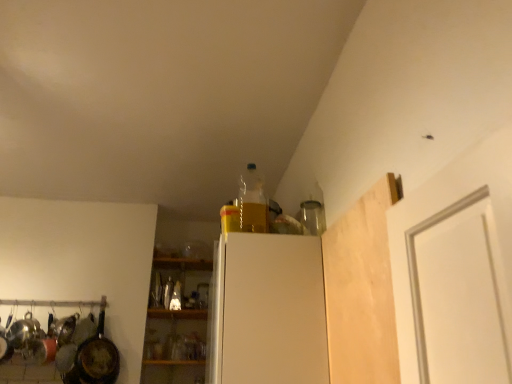
Find the location of a particular element. The image size is (512, 384). light wood/rough plank at upper right is located at coordinates (361, 290).

This screenshot has width=512, height=384. What do you see at coordinates (252, 202) in the screenshot? I see `translucent plastic bottle at upper center, acting as the 1th bottle starting from the front` at bounding box center [252, 202].

The height and width of the screenshot is (384, 512). What do you see at coordinates (97, 357) in the screenshot? I see `rusty metal frying pan at left` at bounding box center [97, 357].

The width and height of the screenshot is (512, 384). What do you see at coordinates (267, 311) in the screenshot?
I see `white matte refrigerator at center` at bounding box center [267, 311].

At what (x,y) coordinates should I click in order to perform the action: click on white matte refrigerator at center. Please return your answer as a coordinate pair (x, y). The image size is (512, 384). Looking at the image, I should click on pyautogui.click(x=267, y=311).

Locate an element on the screen. Image resolution: width=512 pixels, height=384 pixels. translucent glass bottle at center, which is counted as the 2th bottle, starting from the bottom is located at coordinates (168, 292).

Which is closer to the camera, (106, 362) or (253, 185)?

The point (253, 185) is more forward.

From the image's perspective, which one is positioned lower, rusty metal frying pan at left or translucent plastic bottle at upper center, which appears as the first bottle when viewed from the top?

rusty metal frying pan at left.

Considering the sizes of objects rusty metal frying pan at left and translucent plastic bottle at upper center, placed as the third bottle when sorted from bottom to top, in the image provided, who is taller, rusty metal frying pan at left or translucent plastic bottle at upper center, placed as the third bottle when sorted from bottom to top,?

rusty metal frying pan at left is taller.

Which of these two, rusty metal frying pan at left or translucent plastic bottle at upper center, the third bottle in the left-to-right sequence, is bigger?

rusty metal frying pan at left is bigger.

Which is more to the right, translucent plastic bottle at upper center, which appears as the first bottle when viewed from the top, or white matte refrigerator at center?

translucent plastic bottle at upper center, which appears as the first bottle when viewed from the top, is more to the right.

Does translucent plastic bottle at upper center, placed as the third bottle when sorted from bottom to top, have a larger size compared to white matte refrigerator at center?

No.

Are translucent plastic bottle at upper center, the third bottle in the left-to-right sequence, and white matte refrigerator at center located far from each other?

translucent plastic bottle at upper center, the third bottle in the left-to-right sequence, is actually quite close to white matte refrigerator at center.

Considering their positions, is translucent plastic bottle at upper center, the third bottle in the left-to-right sequence, located in front of or behind white matte refrigerator at center?

Visually, translucent plastic bottle at upper center, the third bottle in the left-to-right sequence, is located behind white matte refrigerator at center.

From the image's perspective, who appears lower, light wood/rough plank at upper right or translucent plastic bottle at upper center, placed as the third bottle when sorted from bottom to top?

light wood/rough plank at upper right, from the image's perspective.

Is light wood/rough plank at upper right thinner than translucent plastic bottle at upper center, which appears as the first bottle when viewed from the top?

Yes, light wood/rough plank at upper right is thinner than translucent plastic bottle at upper center, which appears as the first bottle when viewed from the top.

Consider the image. Are light wood/rough plank at upper right and translucent plastic bottle at upper center, marked as the 1th bottle in a right-to-left arrangement, beside each other?

light wood/rough plank at upper right and translucent plastic bottle at upper center, marked as the 1th bottle in a right-to-left arrangement, are not in contact.

How much distance is there between light wood/rough plank at upper right and translucent plastic bottle at upper center, placed as the third bottle when sorted from bottom to top?

22.41 inches.

Looking at this image, considering the sizes of objects white matte refrigerator at center and rusty metal frying pan at left in the image provided, who is wider, white matte refrigerator at center or rusty metal frying pan at left?

white matte refrigerator at center is wider.

Is white matte refrigerator at center spatially inside rusty metal frying pan at left, or outside of it?

white matte refrigerator at center is located beyond the bounds of rusty metal frying pan at left.

Which is more to the right, white matte refrigerator at center or rusty metal frying pan at left?

Positioned to the right is white matte refrigerator at center.

From the image's perspective, would you say translucent glass bottle at center, the 1th bottle positioned from the back, is positioned over white matte refrigerator at center?

No.

Is translucent glass bottle at center, the 1th bottle ordered from the bottom, facing towards white matte refrigerator at center?

No, translucent glass bottle at center, the 1th bottle ordered from the bottom, does not turn towards white matte refrigerator at center.

Is translucent glass bottle at center, the 2th bottle in the right-to-left sequence, at the right side of white matte refrigerator at center?

No, translucent glass bottle at center, the 2th bottle in the right-to-left sequence, is not to the right of white matte refrigerator at center.

From a real-world perspective, is translucent glass bottle at center, which is the third bottle from top to bottom, positioned under white matte refrigerator at center based on gravity?

Incorrect, from a real-world perspective, translucent glass bottle at center, which is the third bottle from top to bottom, is higher than white matte refrigerator at center.

Which is correct: rusty metal frying pan at left is inside white matte refrigerator at center, or outside of it?

rusty metal frying pan at left cannot be found inside white matte refrigerator at center.

Is rusty metal frying pan at left next to white matte refrigerator at center?

No, rusty metal frying pan at left is not beside white matte refrigerator at center.

Is rusty metal frying pan at left oriented towards white matte refrigerator at center?

Yes, rusty metal frying pan at left is oriented towards white matte refrigerator at center.

Between rusty metal frying pan at left and white matte refrigerator at center, which one is positioned in front?

white matte refrigerator at center is in front.

Is the surface of translucent glass bottle at center, the 1th bottle positioned from the back, in direct contact with translucent plastic bottle at upper center, which appears as the first bottle when viewed from the top?

No, translucent glass bottle at center, the 1th bottle positioned from the back, is not with translucent plastic bottle at upper center, which appears as the first bottle when viewed from the top.

Where is `bottle that is the 2nd object located below the translucent plastic bottle at upper center, acting as the third bottle starting from the back (from the image's perspective)`? The height and width of the screenshot is (384, 512). bottle that is the 2nd object located below the translucent plastic bottle at upper center, acting as the third bottle starting from the back (from the image's perspective) is located at coordinates (176, 297).

Can you tell me how much translucent glass bottle at center, the 2th bottle in the right-to-left sequence, and translucent plastic bottle at upper center, marked as the 1th bottle in a right-to-left arrangement, differ in facing direction?

87.7 degrees separate the facing orientations of translucent glass bottle at center, the 2th bottle in the right-to-left sequence, and translucent plastic bottle at upper center, marked as the 1th bottle in a right-to-left arrangement.

Could you measure the distance between translucent glass bottle at center, which ranks as the second bottle in left-to-right order, and translucent plastic bottle at upper center, which appears as the first bottle when viewed from the top?

translucent glass bottle at center, which ranks as the second bottle in left-to-right order, is 4.91 feet away from translucent plastic bottle at upper center, which appears as the first bottle when viewed from the top.

Find the location of a particular element. This screenshot has width=512, height=384. frying pan that appears below the translucent plastic bottle at upper center, acting as the third bottle starting from the back (from a real-world perspective) is located at coordinates (97, 357).

You are a GUI agent. You are given a task and a screenshot of the screen. Output one action in this format:
    pyautogui.click(x=<x>, y=<y>)
    Task: Click on the bottle that is the 3rd one above the white matte refrigerator at center (from a real-world perspective)
    This screenshot has width=512, height=384.
    Given the screenshot: What is the action you would take?
    pyautogui.click(x=252, y=202)

Estimate the real-world distances between objects in this image. Which object is further from rusty metal frying pan at left, translucent glass bottle at center, which is the third bottle in right-to-left order, or translucent glass bottle at center, the 1th bottle positioned from the back?

translucent glass bottle at center, the 1th bottle positioned from the back, is further to rusty metal frying pan at left.

Considering their positions, is translucent plastic bottle at upper center, marked as the 1th bottle in a right-to-left arrangement, positioned closer to light wood/rough plank at upper right than translucent glass bottle at center, which ranks as the second bottle in left-to-right order?

translucent plastic bottle at upper center, marked as the 1th bottle in a right-to-left arrangement, is positioned closer to the anchor light wood/rough plank at upper right.

When comparing their distances from light wood/rough plank at upper right, does translucent glass bottle at center, which is the third bottle in right-to-left order, or white matte refrigerator at center seem further?

translucent glass bottle at center, which is the third bottle in right-to-left order.

Estimate the real-world distances between objects in this image. Which object is closer to white matte refrigerator at center, translucent plastic bottle at upper center, marked as the 1th bottle in a right-to-left arrangement, or light wood/rough plank at upper right?

Among the two, translucent plastic bottle at upper center, marked as the 1th bottle in a right-to-left arrangement, is located nearer to white matte refrigerator at center.

Considering their positions, is translucent glass bottle at center, which ranks as the 2th bottle in back-to-front order, positioned closer to light wood/rough plank at upper right than translucent plastic bottle at upper center, acting as the third bottle starting from the back?

translucent plastic bottle at upper center, acting as the third bottle starting from the back, lies closer to light wood/rough plank at upper right than the other object.

Looking at the image, which one is located further to rusty metal frying pan at left, translucent glass bottle at center, which is the third bottle from top to bottom, or translucent plastic bottle at upper center, the third bottle in the left-to-right sequence?

translucent plastic bottle at upper center, the third bottle in the left-to-right sequence, is positioned further to the anchor rusty metal frying pan at left.

Which object lies nearer to the anchor point white matte refrigerator at center, translucent glass bottle at center, which is the third bottle in right-to-left order, or translucent glass bottle at center, the 1th bottle ordered from the bottom?

translucent glass bottle at center, the 1th bottle ordered from the bottom.

Which object lies further to the anchor point rusty metal frying pan at left, light wood/rough plank at upper right or translucent glass bottle at center, the 1th bottle positioned from the back?

Based on the image, light wood/rough plank at upper right appears to be further to rusty metal frying pan at left.

You are a GUI agent. You are given a task and a screenshot of the screen. Output one action in this format:
    pyautogui.click(x=<x>, y=<y>)
    Task: Click on the frying pan between light wood/rough plank at upper right and translucent glass bottle at center, which ranks as the second bottle in left-to-right order, along the z-axis
    Image resolution: width=512 pixels, height=384 pixels.
    Given the screenshot: What is the action you would take?
    pyautogui.click(x=97, y=357)

Identify the location of bottle between rusty metal frying pan at left and translucent glass bottle at center, which is the third bottle from top to bottom, along the z-axis. The width and height of the screenshot is (512, 384). (168, 292).

This screenshot has width=512, height=384. Identify the location of refrigerator between light wood/rough plank at upper right and translucent glass bottle at center, which is counted as the 2th bottle, starting from the bottom, from front to back. (267, 311).

Image resolution: width=512 pixels, height=384 pixels. Identify the location of refrigerator between rusty metal frying pan at left and translucent plastic bottle at upper center, which appears as the first bottle when viewed from the top. (267, 311).